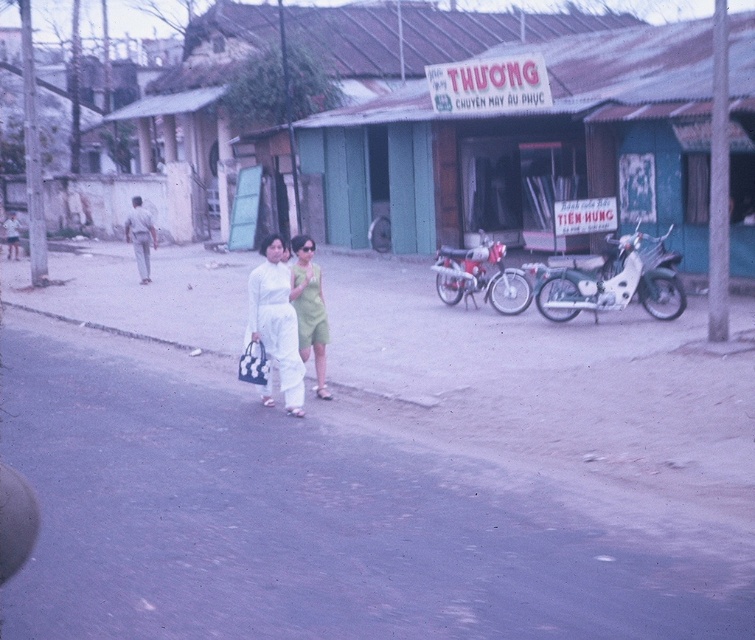
Question: Among these objects, which one is nearest to the camera?

Choices:
 (A) white matte dress at center
 (B) white matte motorcycle at right
 (C) light gray cotton pants at left
 (D) metallic red motorcycle at center

Answer: (A)

Question: Which of these objects is positioned farthest from the white matte motorcycle at right?

Choices:
 (A) green matte dress at center
 (B) metallic red motorcycle at center
 (C) light gray cotton pants at left
 (D) white matte dress at center

Answer: (C)

Question: Is white matte motorcycle at right smaller than metallic red motorcycle at center?

Choices:
 (A) yes
 (B) no

Answer: (B)

Question: Does white matte dress at center have a lesser width compared to light gray cotton pants at left?

Choices:
 (A) no
 (B) yes

Answer: (B)

Question: Considering the real-world distances, which object is closest to the white matte motorcycle at right?

Choices:
 (A) metallic red motorcycle at center
 (B) green matte dress at center
 (C) white matte dress at center
 (D) light gray cotton pants at left

Answer: (A)

Question: Does white matte motorcycle at right have a greater width compared to white matte dress at center?

Choices:
 (A) yes
 (B) no

Answer: (A)